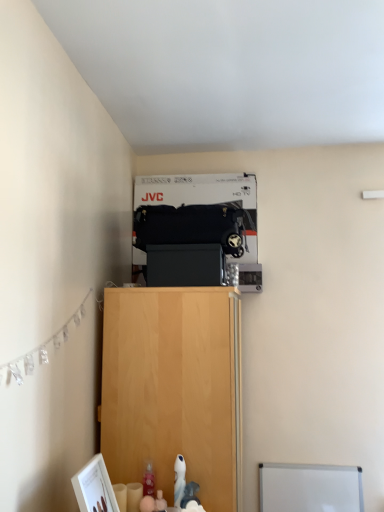
Question: Should I look upward or downward to see light wood cabinet at center?

Choices:
 (A) up
 (B) down

Answer: (B)